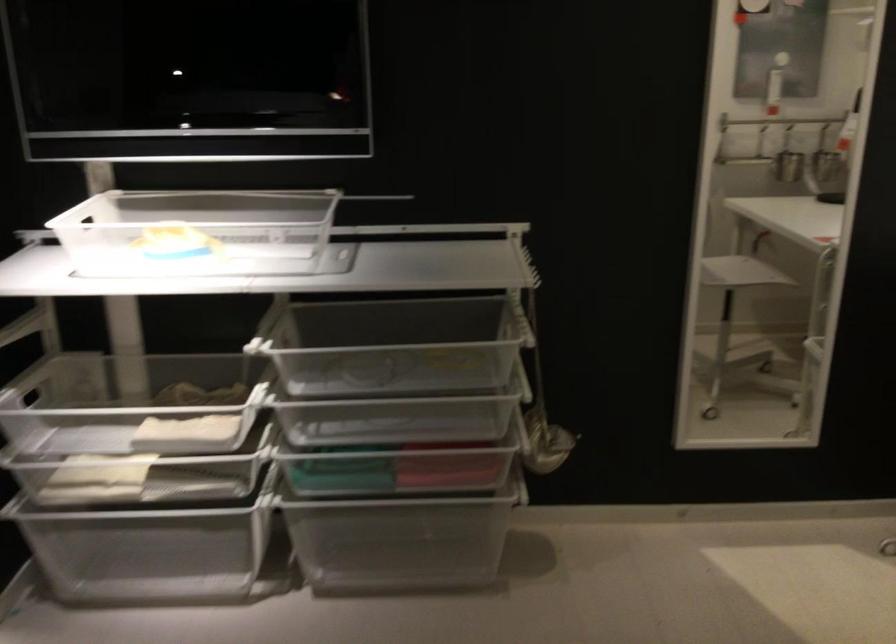
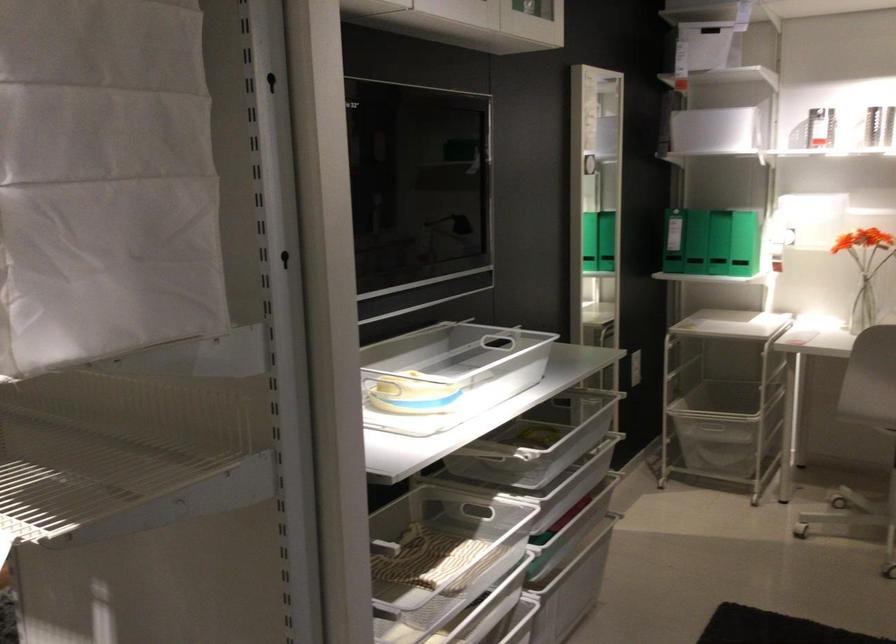
Question: I am providing you with two images of the same scene from different viewpoints. After the viewpoint changes to image2, which objects are now occluded?

Choices:
 (A) clear glass vase
 (B) plastic drawer handle
 (C) basket handle
 (D) orange and white cup

Answer: (C)